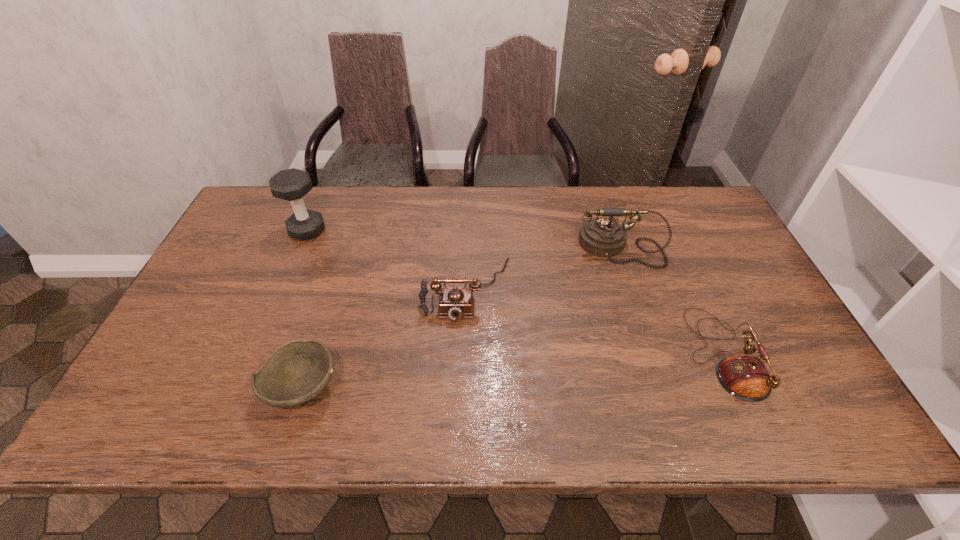
This screenshot has width=960, height=540. What are the coordinates of `vacant area between the shortest object and the dumbbell` in the screenshot? It's located at (305, 309).

Locate an element on the screen. free space that is in between the third object from right to left and the tallest telephone is located at coordinates tap(542, 268).

This screenshot has width=960, height=540. Find the location of `vacant space that's between the shortest object and the leftmost telephone`. vacant space that's between the shortest object and the leftmost telephone is located at coordinates (385, 339).

I want to click on vacant point located between the tallest object and the leftmost telephone, so click(387, 260).

Where is `free space between the tallest telephone and the third object from right to left`? Image resolution: width=960 pixels, height=540 pixels. free space between the tallest telephone and the third object from right to left is located at coordinates (542, 268).

At what (x,y) coordinates should I click in order to perform the action: click on unoccupied area between the tallest object and the leftmost telephone. Please return your answer as a coordinate pair (x, y). This screenshot has height=540, width=960. Looking at the image, I should click on (387, 260).

In order to click on vacant space that's between the shortest object and the third object from right to left in this screenshot , I will do `click(385, 339)`.

This screenshot has width=960, height=540. Find the location of `object identified as the closest to the dumbbell`. object identified as the closest to the dumbbell is located at coordinates (455, 303).

Locate which object is the third closest to the dumbbell. Please provide its 2D coordinates. Your answer should be formatted as a tuple, i.e. [(x, y)], where the tuple contains the x and y coordinates of a point satisfying the conditions above.

[(605, 237)]

The height and width of the screenshot is (540, 960). I want to click on telephone that stands as the third closest to the dumbbell, so click(745, 377).